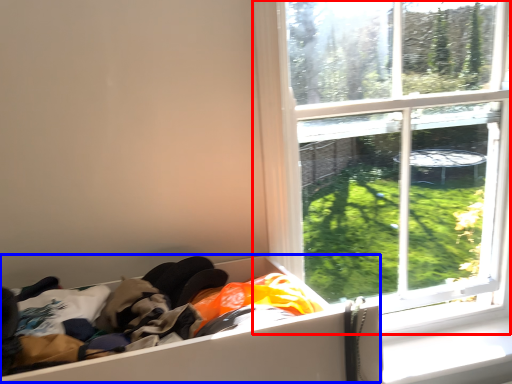
Question: Which object appears closest to the camera in this image, window (highlighted by a red box) or storage box (highlighted by a blue box)?

Choices:
 (A) window
 (B) storage box

Answer: (B)